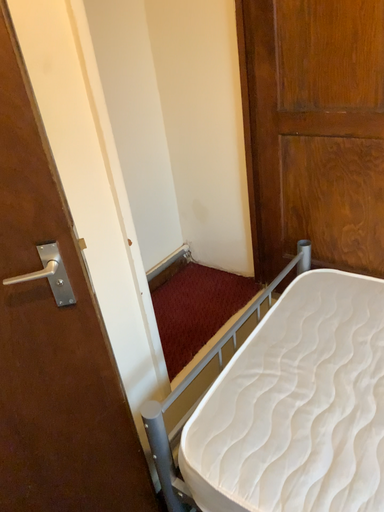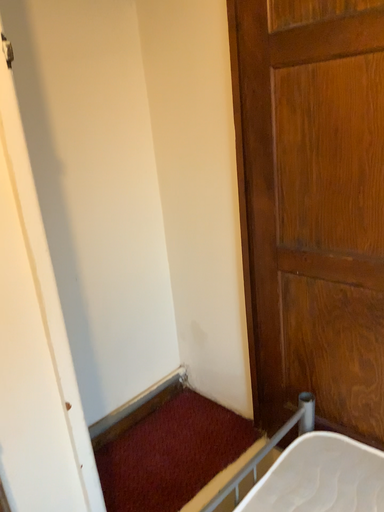
Question: How did the camera likely rotate when shooting the video?

Choices:
 (A) rotated upward
 (B) rotated downward

Answer: (A)